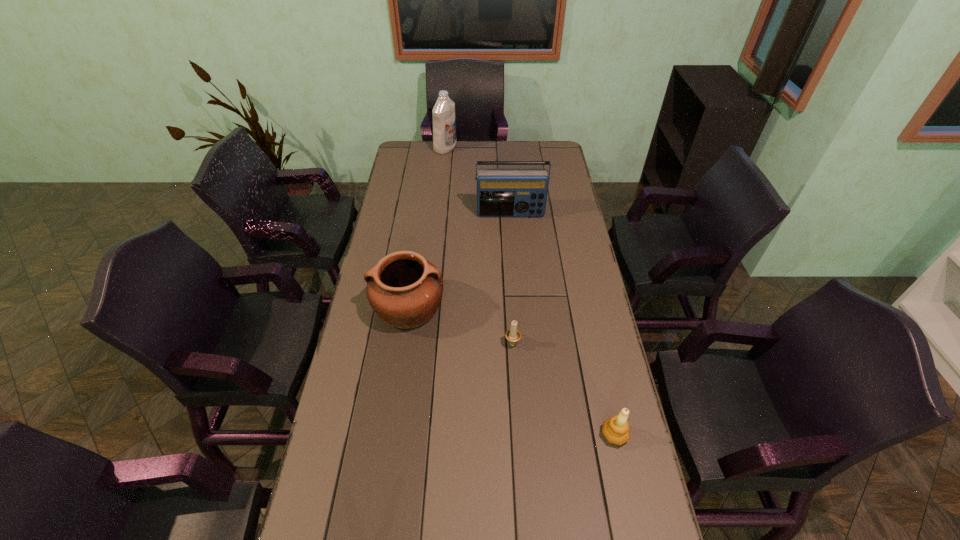
What are the coordinates of `object that is the closest to the fourth shortest object` in the screenshot? It's located at tap(404, 289).

At what (x,y) coordinates should I click in order to perform the action: click on candle_holder object that ranks as the closest to the tallest object. Please return your answer as a coordinate pair (x, y). Image resolution: width=960 pixels, height=540 pixels. Looking at the image, I should click on (513, 335).

Identify the location of the second closest candle_holder to the second farthest object. (616, 430).

This screenshot has height=540, width=960. I want to click on free location that satisfies the following two spatial constraints: 1. on the front side of the third shortest object; 2. on the left side of the second shortest object, so click(391, 435).

Where is `vacant position in the image that satisfies the following two spatial constraints: 1. on the front panel of the second farthest object; 2. on the right side of the rightmost object`? This screenshot has height=540, width=960. vacant position in the image that satisfies the following two spatial constraints: 1. on the front panel of the second farthest object; 2. on the right side of the rightmost object is located at coordinates click(x=528, y=435).